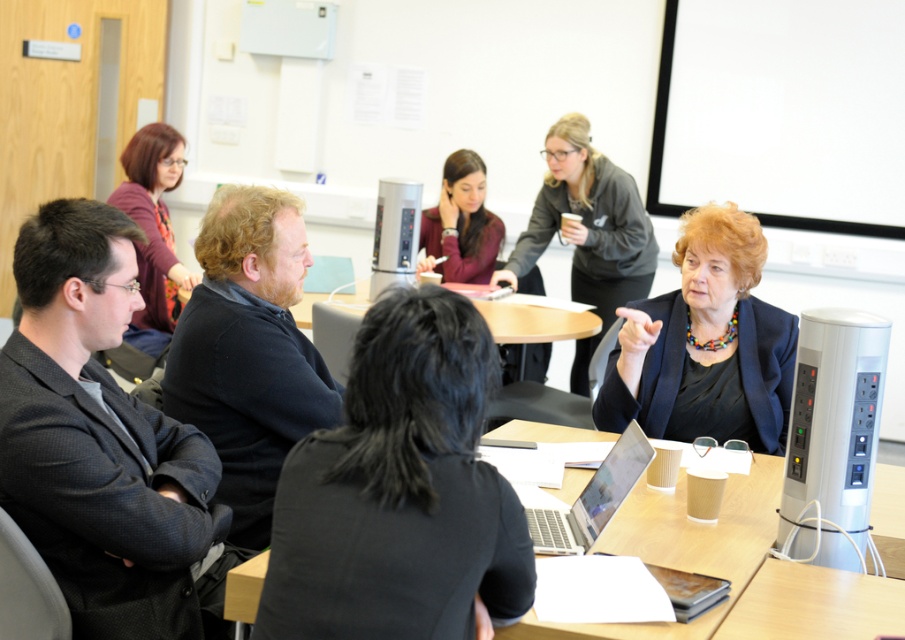
Question: Which object is closer to the camera taking this photo?

Choices:
 (A) matte maroon sweater at center
 (B) dark blue blazer at center

Answer: (B)

Question: Which is nearer to the dark blue blazer at center?

Choices:
 (A) silver metallic laptop at center
 (B) wooden table at center
 (C) matte black jacket at upper left
 (D) black glossy blazer at center

Answer: (D)

Question: Is black glossy blazer at center to the right of matte black jacket at upper left from the viewer's perspective?

Choices:
 (A) yes
 (B) no

Answer: (A)

Question: Which point is farther to the camera?

Choices:
 (A) (724, 264)
 (B) (561, 205)

Answer: (B)

Question: Does dark blue blazer at center lie behind matte maroon sweater at center?

Choices:
 (A) no
 (B) yes

Answer: (A)

Question: Is black glossy blazer at center positioned behind matte black jacket at upper left?

Choices:
 (A) no
 (B) yes

Answer: (A)